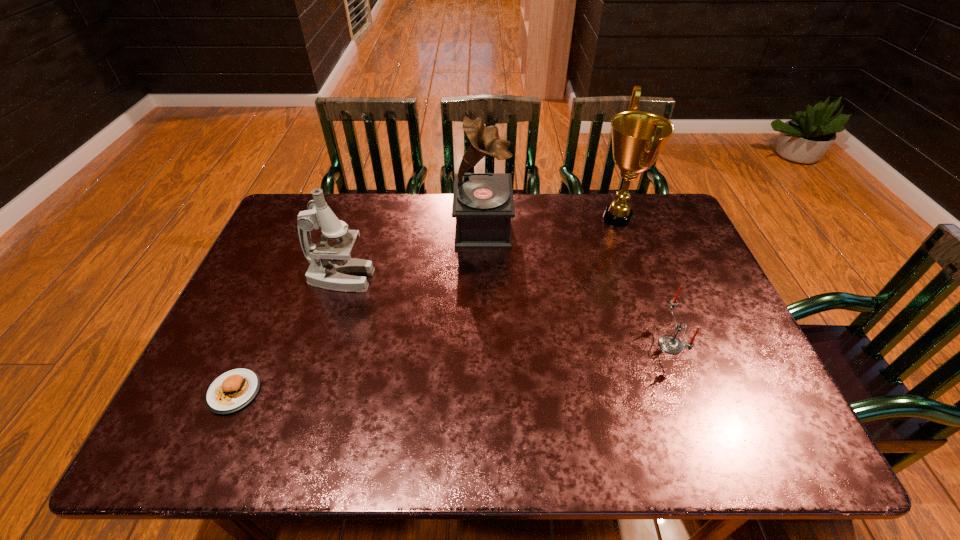
In order to click on phonograph_record that is positioned at the far edge in this screenshot , I will do `click(483, 205)`.

Identify the location of object that is at the left edge. This screenshot has height=540, width=960. (235, 389).

The image size is (960, 540). What are the coordinates of `award that is at the right edge` in the screenshot? It's located at (638, 137).

Image resolution: width=960 pixels, height=540 pixels. Find the location of `candle that is at the right edge`. candle that is at the right edge is located at coordinates pos(670,344).

The width and height of the screenshot is (960, 540). In order to click on object present at the far right corner in this screenshot , I will do `click(638, 137)`.

Locate an element on the screen. free point at the far edge is located at coordinates [439, 199].

This screenshot has height=540, width=960. What are the coordinates of `free region at the near edge of the desktop` in the screenshot? It's located at coord(617,436).

The image size is (960, 540). I want to click on blank area at the left edge, so click(268, 254).

Locate an element on the screen. Image resolution: width=960 pixels, height=540 pixels. blank space at the right edge is located at coordinates (693, 252).

In order to click on free space at the far left corner in this screenshot , I will do `click(336, 195)`.